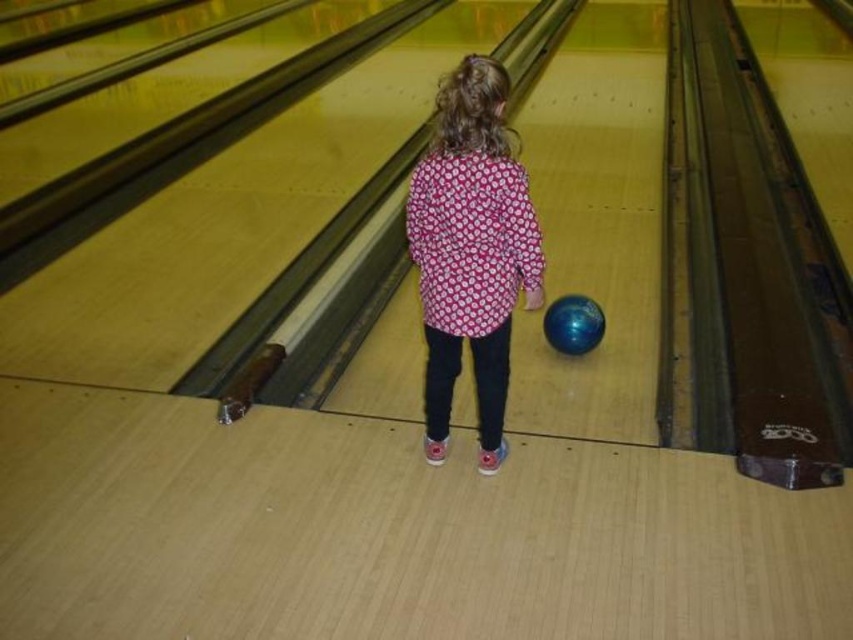
You are a bowler standing at the end of the lane. You notice a point marked at coordinates (x=471, y=250) on the lane. What object is located at that point?

The point at coordinates (x=471, y=250) corresponds to the pink dotted shirt at center.

You are a photographer setting up for a child bowling event. You need to ensure the pink dotted shirt at center and the blue glossy bowling ball at center are both visible in the photo. Given their sizes, which object should you focus on first to ensure both are in frame?

The pink dotted shirt at center is larger than the blue glossy bowling ball at center, so focusing on the shirt first will help ensure both are in frame as the larger object occupies more space.

Looking at this image, you are a bowling coach observing a child in a pink dotted shirt at center and a blue glossy bowling ball at center. The child is about to throw the ball. Based on their positions, which object is closer to you?

The pink dotted shirt at center is closer to you because it is in front of the blue glossy bowling ball at center.